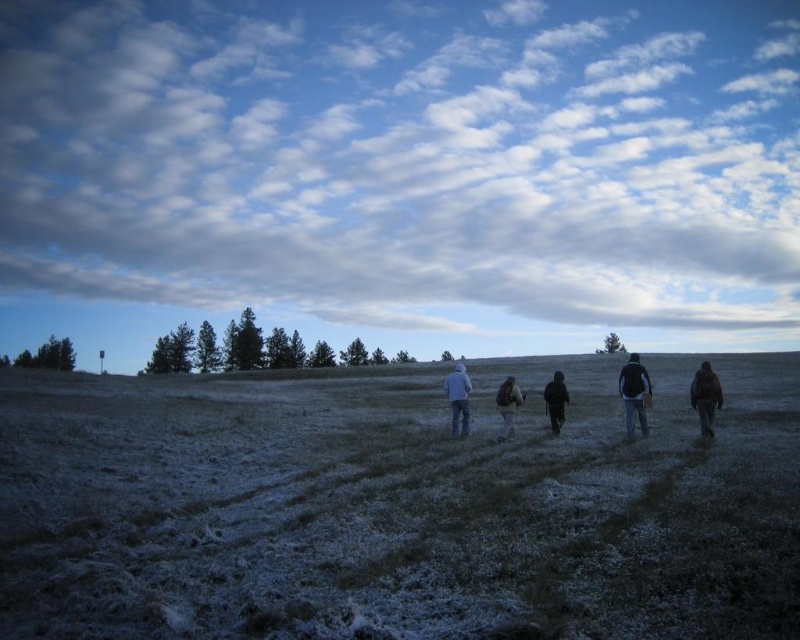
Does cloudy sky at upper center have a greater height compared to frosted grass at center?

Correct, cloudy sky at upper center is much taller as frosted grass at center.

Where is `cloudy sky at upper center`? Image resolution: width=800 pixels, height=640 pixels. cloudy sky at upper center is located at coordinates (406, 161).

Is the position of black matte jacket at right more distant than that of blue denim jeans at center?

No, black matte jacket at right is closer to the viewer.

Between black matte jacket at right and blue denim jeans at center, which one has more height?

black matte jacket at right

The height and width of the screenshot is (640, 800). Describe the element at coordinates (634, 394) in the screenshot. I see `black matte jacket at right` at that location.

What are the coordinates of `black matte jacket at right` in the screenshot? It's located at (634, 394).

Can you confirm if cloudy sky at upper center is bigger than black matte jacket at center?

Correct, cloudy sky at upper center is larger in size than black matte jacket at center.

Is cloudy sky at upper center below black matte jacket at center?

Incorrect, cloudy sky at upper center is not positioned below black matte jacket at center.

Identify the location of cloudy sky at upper center. The image size is (800, 640). (406, 161).